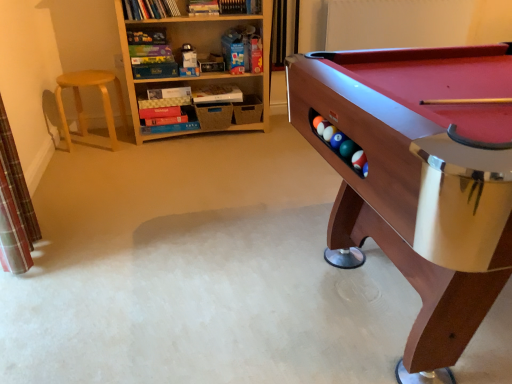
Question: Is the surface of wooden pool table at right in direct contact with light brown wooden stool at left?

Choices:
 (A) no
 (B) yes

Answer: (A)

Question: Would you consider wooden pool table at right to be distant from light brown wooden stool at left?

Choices:
 (A) no
 (B) yes

Answer: (B)

Question: From the image's perspective, would you say wooden pool table at right is shown under light brown wooden stool at left?

Choices:
 (A) no
 (B) yes

Answer: (B)

Question: Is wooden pool table at right taller than light brown wooden stool at left?

Choices:
 (A) no
 (B) yes

Answer: (B)

Question: From a real-world perspective, is wooden pool table at right positioned under light brown wooden stool at left based on gravity?

Choices:
 (A) yes
 (B) no

Answer: (B)

Question: Considering the positions of point (338, 218) and point (60, 87), is point (338, 218) closer or farther from the camera than point (60, 87)?

Choices:
 (A) farther
 (B) closer

Answer: (B)

Question: Considering the positions of wooden pool table at right and light brown wooden stool at left in the image, is wooden pool table at right bigger or smaller than light brown wooden stool at left?

Choices:
 (A) big
 (B) small

Answer: (A)

Question: From a real-world perspective, is wooden pool table at right positioned above or below light brown wooden stool at left?

Choices:
 (A) below
 (B) above

Answer: (B)

Question: Is wooden pool table at right wider or thinner than light brown wooden stool at left?

Choices:
 (A) wide
 (B) thin

Answer: (A)

Question: From the image's perspective, relative to light brown wooden stool at left, is wooden bookshelf at upper left above or below?

Choices:
 (A) below
 (B) above

Answer: (B)

Question: Visually, is wooden bookshelf at upper left positioned to the left or to the right of light brown wooden stool at left?

Choices:
 (A) left
 (B) right

Answer: (B)

Question: Based on their sizes in the image, would you say wooden bookshelf at upper left is bigger or smaller than light brown wooden stool at left?

Choices:
 (A) small
 (B) big

Answer: (B)

Question: In terms of width, does wooden bookshelf at upper left look wider or thinner when compared to light brown wooden stool at left?

Choices:
 (A) wide
 (B) thin

Answer: (B)

Question: From the image's perspective, is light brown wooden stool at left positioned above or below wooden bookshelf at upper left?

Choices:
 (A) above
 (B) below

Answer: (B)

Question: Visually, is light brown wooden stool at left positioned to the left or to the right of wooden bookshelf at upper left?

Choices:
 (A) right
 (B) left

Answer: (B)